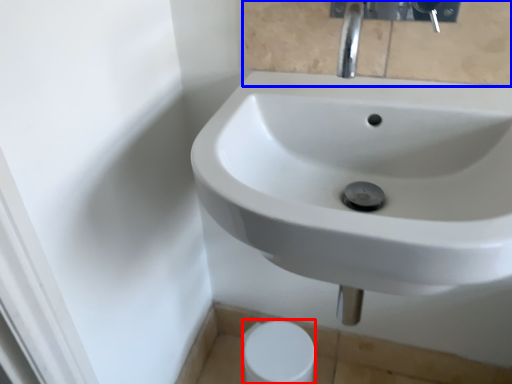
Question: Which object appears closest to the camera in this image, toilet paper (highlighted by a red box) or mirror (highlighted by a blue box)?

Choices:
 (A) toilet paper
 (B) mirror

Answer: (B)